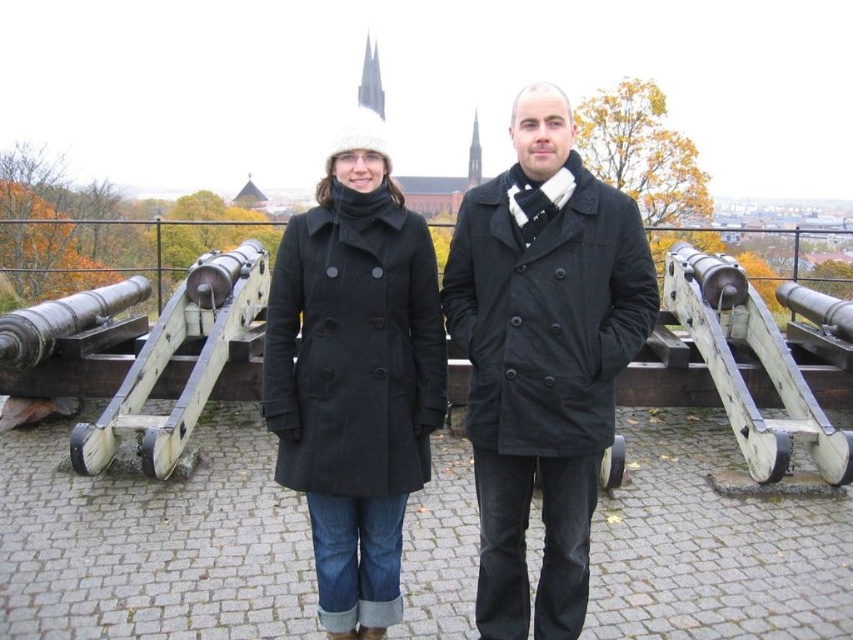
From the picture: You are a tour guide explaining the historical cannons to visitors. You mention that one of the cannons is located at a specific coordinate. Which cannon is at point (757,358)?

The wooden cannon at right is located at point (757,358).

You are a tailor measuring for a custom coat. You observe the black woolen coat at center and the wooden cannon at right in the image. Which object is wider?

The black woolen coat at center is wider than the wooden cannon at right.

You are standing in front of the cannons at the historical site and want to walk towards the point that is closer to you. Which point should you head towards, point (517, 556) or point (747, 289)?

You should head towards point (517, 556) because it is closer to the viewer than point (747, 289).